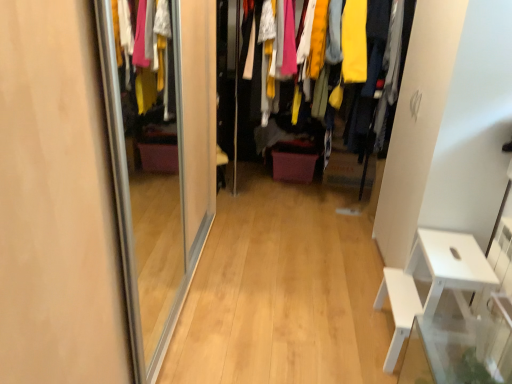
Find the location of a particular element. free space to the left of white plastic table at right is located at coordinates (340, 334).